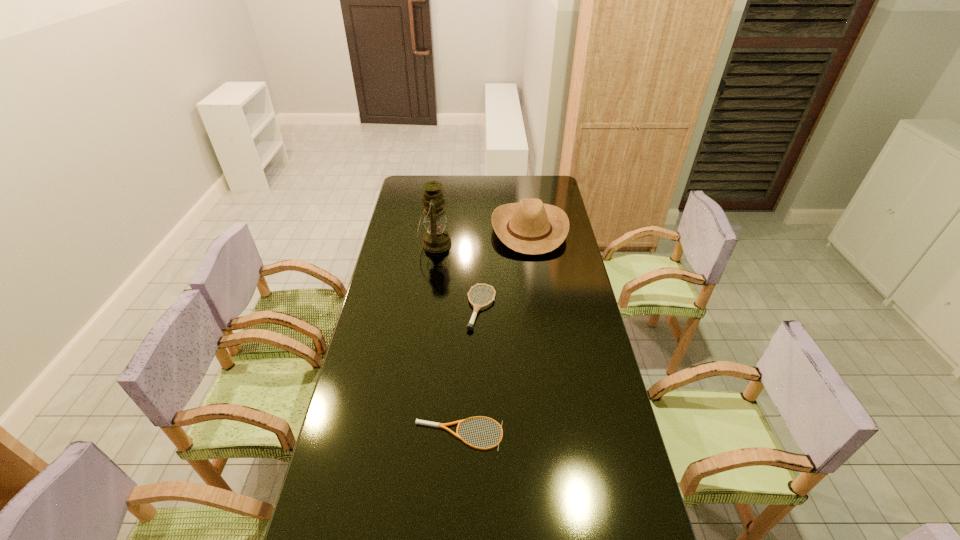
Image resolution: width=960 pixels, height=540 pixels. Find the location of `free spot between the tallest object and the taller tennis racket`. free spot between the tallest object and the taller tennis racket is located at coordinates (459, 276).

Where is `vacant space that's between the nearest object and the tallest object`? This screenshot has height=540, width=960. vacant space that's between the nearest object and the tallest object is located at coordinates (447, 339).

Locate an element on the screen. free space between the taller tennis racket and the shortest object is located at coordinates (470, 371).

Where is `object that is the third closest to the second nearest object`? The image size is (960, 540). object that is the third closest to the second nearest object is located at coordinates (422, 422).

The width and height of the screenshot is (960, 540). Find the location of `the second closest object to the cowboy hat`. the second closest object to the cowboy hat is located at coordinates (469, 326).

Find the location of `tennis racket that can be found as the closest to the oil lamp`. tennis racket that can be found as the closest to the oil lamp is located at coordinates [469, 326].

Find the location of `blank area in the image that satisfies the following two spatial constraints: 1. on the front-facing side of the cowboy hat; 2. on the front side of the shorter tennis racket`. blank area in the image that satisfies the following two spatial constraints: 1. on the front-facing side of the cowboy hat; 2. on the front side of the shorter tennis racket is located at coordinates (559, 434).